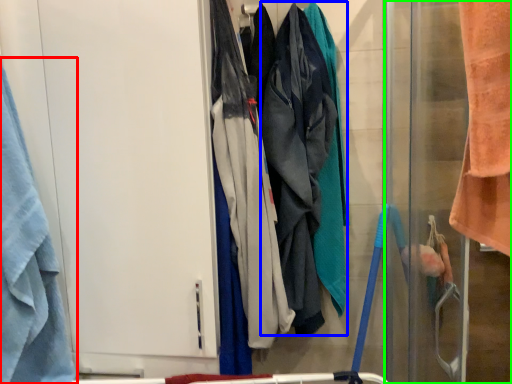
Question: Considering the real-world distances, which object is closest to towel (highlighted by a red box)? wide (highlighted by a blue box) or screen door (highlighted by a green box).

Choices:
 (A) wide
 (B) screen door

Answer: (A)